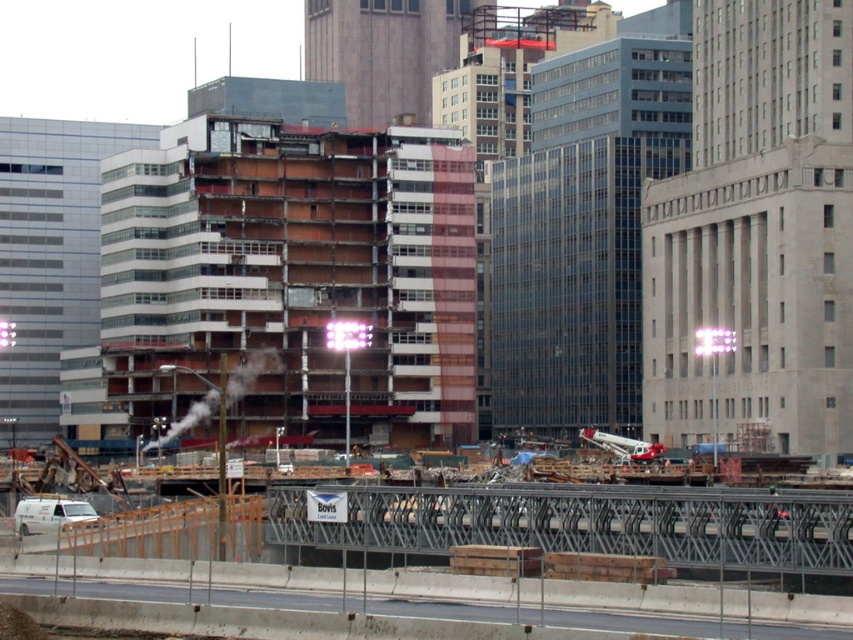
Question: Which point is closer to the camera?

Choices:
 (A) exposed concrete building at center
 (B) metal/wooden fencing at lower center

Answer: (B)

Question: Can you confirm if exposed concrete building at center is wider than metal/wooden fencing at lower center?

Choices:
 (A) yes
 (B) no

Answer: (A)

Question: Is exposed concrete building at center below metal/wooden fencing at lower center?

Choices:
 (A) no
 (B) yes

Answer: (A)

Question: Which point is closer to the camera?

Choices:
 (A) exposed concrete building at center
 (B) metal/wooden fencing at lower center

Answer: (B)

Question: Which point is closer to the camera?

Choices:
 (A) metal/wooden fencing at lower center
 (B) exposed concrete building at center

Answer: (A)

Question: Considering the relative positions of exposed concrete building at center and metal/wooden fencing at lower center in the image provided, where is exposed concrete building at center located with respect to metal/wooden fencing at lower center?

Choices:
 (A) left
 (B) right

Answer: (A)